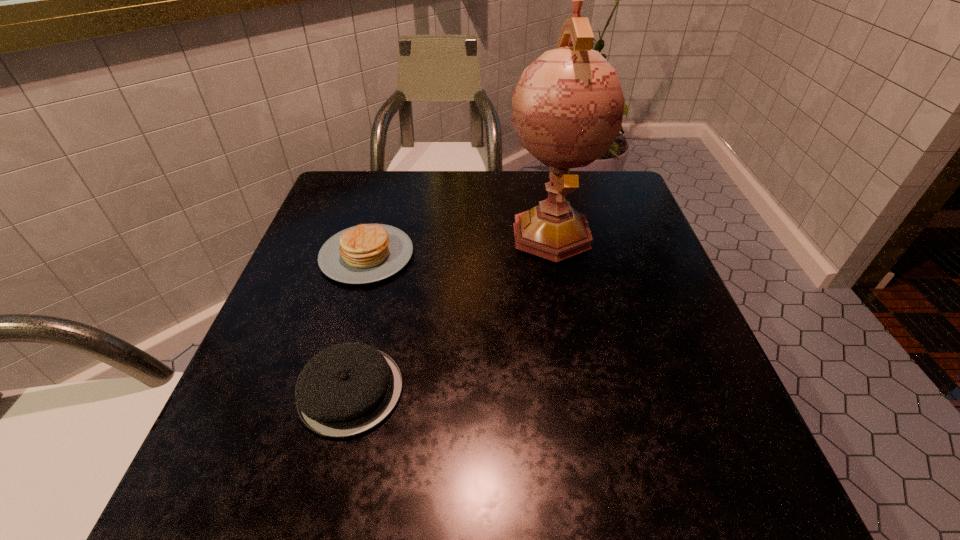
The width and height of the screenshot is (960, 540). I want to click on free space between the globe and the nearer pancake, so click(x=451, y=311).

Where is `free spot between the tallest object and the farther pancake`? The width and height of the screenshot is (960, 540). free spot between the tallest object and the farther pancake is located at coordinates (459, 244).

Where is `free space that is in between the farther pancake and the nearer pancake`? free space that is in between the farther pancake and the nearer pancake is located at coordinates (359, 323).

Locate an element on the screen. This screenshot has height=540, width=960. free spot between the nearest object and the farther pancake is located at coordinates (359, 323).

You are a GUI agent. You are given a task and a screenshot of the screen. Output one action in this format:
    pyautogui.click(x=<x>, y=<y>)
    Task: Click on the vacant area that lies between the farther pancake and the nearer pancake
    The image size is (960, 540).
    Given the screenshot: What is the action you would take?
    pyautogui.click(x=359, y=323)

Image resolution: width=960 pixels, height=540 pixels. I want to click on free space between the farther pancake and the nearer pancake, so click(x=359, y=323).

Identify the location of free spot between the farther pancake and the nearer pancake. The image size is (960, 540). (359, 323).

Locate which object is the closest to the nearer pancake. Please provide its 2D coordinates. Your answer should be formatted as a tuple, i.e. [(x, y)], where the tuple contains the x and y coordinates of a point satisfying the conditions above.

[(366, 253)]

Identify which object is the closest to the nearest object. Please provide its 2D coordinates. Your answer should be formatted as a tuple, i.e. [(x, y)], where the tuple contains the x and y coordinates of a point satisfying the conditions above.

[(366, 253)]